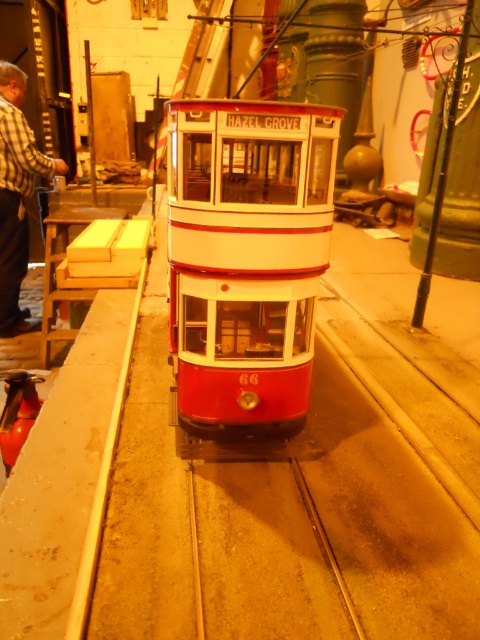
Question: Can you confirm if red matte double-decker bus at center is positioned to the right of metallic/smooth train track at center?

Choices:
 (A) yes
 (B) no

Answer: (B)

Question: Among these points, which one is farthest from the camera?

Choices:
 (A) (251, 164)
 (B) (28, 172)

Answer: (A)

Question: Which point appears farthest from the camera in this image?

Choices:
 (A) (211, 465)
 (B) (16, 234)

Answer: (B)

Question: Among these objects, which one is farthest from the camera?

Choices:
 (A) metallic/smooth train track at center
 (B) red matte double-decker bus at center
 (C) plaid shirt at left

Answer: (C)

Question: Is red matte double-decker bus at center above plaid shirt at left?

Choices:
 (A) yes
 (B) no

Answer: (B)

Question: In this image, where is red matte double-decker bus at center located relative to metallic/smooth train track at center?

Choices:
 (A) right
 (B) left

Answer: (B)